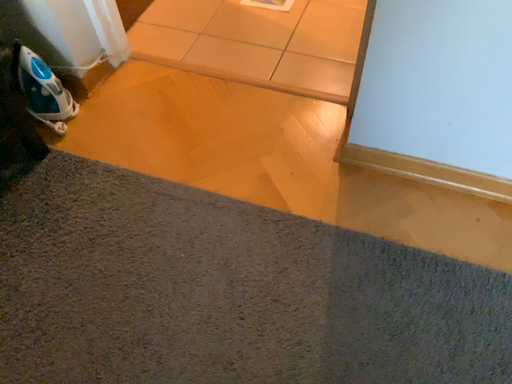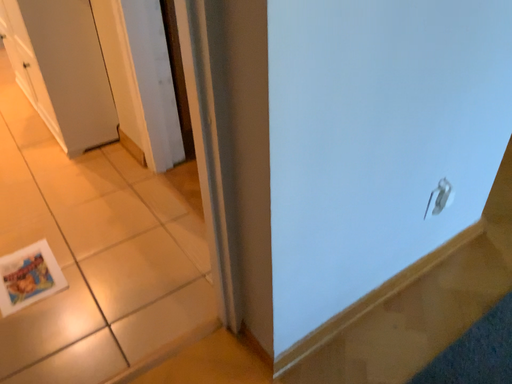
Question: How did the camera likely rotate when shooting the video?

Choices:
 (A) rotated left
 (B) rotated right

Answer: (B)